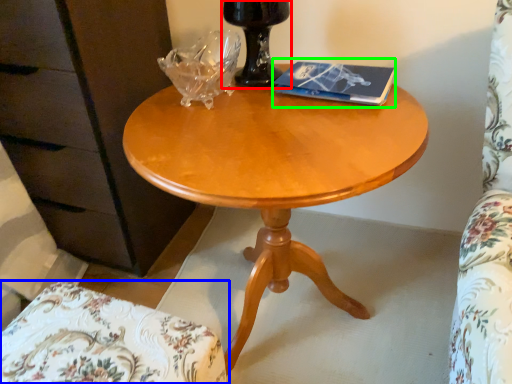
Question: Considering the real-world distances, which object is closest to glass vase (highlighted by a red box)? chair (highlighted by a blue box) or paperback book (highlighted by a green box).

Choices:
 (A) chair
 (B) paperback book

Answer: (B)